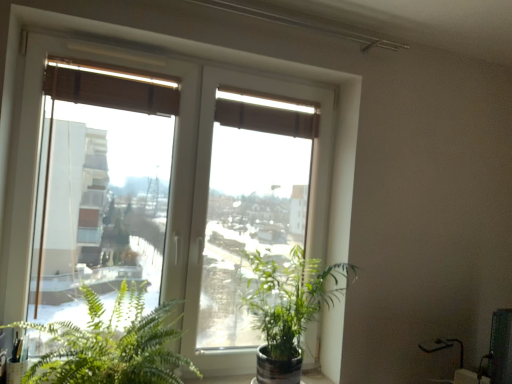
Question: Is green leafy plant at lower left, positioned as the first houseplant in left-to-right order, completely or partially outside of transparent glass window at center?

Choices:
 (A) yes
 (B) no

Answer: (A)

Question: Does green leafy plant at lower left, the second houseplant viewed from the right, have a larger size compared to transparent glass window at center?

Choices:
 (A) yes
 (B) no

Answer: (B)

Question: From a real-world perspective, is green leafy plant at lower left, positioned as the first houseplant in left-to-right order, on top of transparent glass window at center?

Choices:
 (A) no
 (B) yes

Answer: (A)

Question: Are green leafy plant at lower left, positioned as the first houseplant in left-to-right order, and transparent glass window at center beside each other?

Choices:
 (A) yes
 (B) no

Answer: (B)

Question: Considering the relative positions of green leafy plant at lower left, the second houseplant viewed from the right, and transparent glass window at center in the image provided, is green leafy plant at lower left, the second houseplant viewed from the right, in front of transparent glass window at center?

Choices:
 (A) no
 (B) yes

Answer: (B)

Question: From the image's perspective, is brown fabric curtain at upper center positioned above or below green leafy plant at lower left, positioned as the first houseplant in left-to-right order?

Choices:
 (A) above
 (B) below

Answer: (A)

Question: From a real-world perspective, is brown fabric curtain at upper center physically located above or below green leafy plant at lower left, positioned as the first houseplant in left-to-right order?

Choices:
 (A) above
 (B) below

Answer: (A)

Question: Is brown fabric curtain at upper center inside the boundaries of green leafy plant at lower left, the second houseplant viewed from the right, or outside?

Choices:
 (A) inside
 (B) outside

Answer: (B)

Question: In the image, is brown fabric curtain at upper center positioned in front of or behind green leafy plant at lower left, the second houseplant viewed from the right?

Choices:
 (A) behind
 (B) front

Answer: (A)

Question: Based on their sizes in the image, would you say brown fabric curtain at upper center is bigger or smaller than green glossy plant at center, marked as the 2th houseplant in a left-to-right arrangement?

Choices:
 (A) big
 (B) small

Answer: (B)

Question: In the image, is brown fabric curtain at upper center positioned in front of or behind green glossy plant at center, marked as the 2th houseplant in a left-to-right arrangement?

Choices:
 (A) behind
 (B) front

Answer: (A)

Question: Is brown fabric curtain at upper center inside the boundaries of green glossy plant at center, marked as the 2th houseplant in a left-to-right arrangement, or outside?

Choices:
 (A) outside
 (B) inside

Answer: (A)

Question: Is brown fabric curtain at upper center taller or shorter than green glossy plant at center, marked as the 2th houseplant in a left-to-right arrangement?

Choices:
 (A) short
 (B) tall

Answer: (A)

Question: Is transparent glass window at center wider or thinner than green leafy plant at lower left, the second houseplant viewed from the right?

Choices:
 (A) wide
 (B) thin

Answer: (B)

Question: Is transparent glass window at center bigger or smaller than green leafy plant at lower left, positioned as the first houseplant in left-to-right order?

Choices:
 (A) big
 (B) small

Answer: (A)